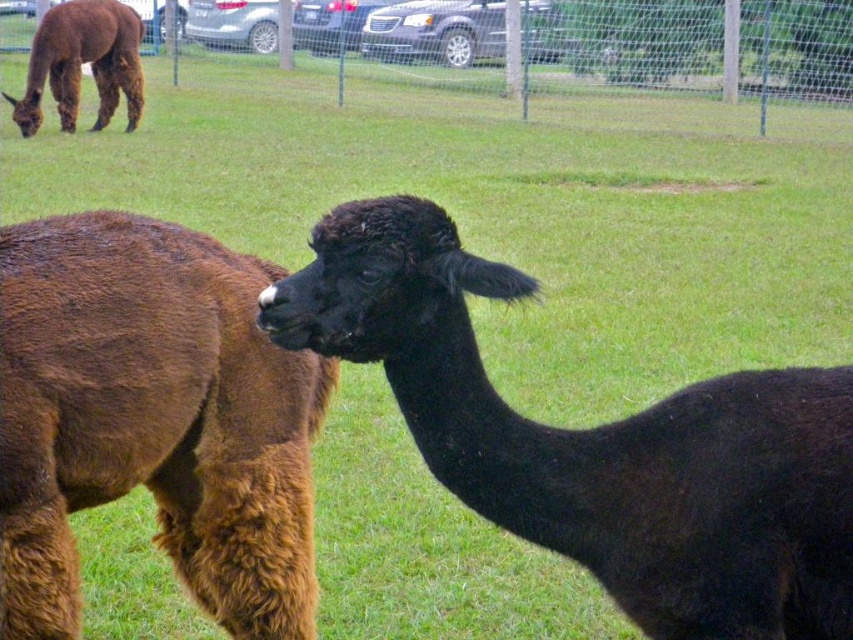
Question: Is brown fuzzy camel at left to the left of fence at upper center from the viewer's perspective?

Choices:
 (A) no
 (B) yes

Answer: (A)

Question: Based on their relative distances, which object is farther from the brown woolly alpaca at upper left?

Choices:
 (A) fence at upper center
 (B) black fuzzy alpaca at center

Answer: (B)

Question: Is black fuzzy alpaca at center in front of fence at upper center?

Choices:
 (A) no
 (B) yes

Answer: (B)

Question: Based on their relative distances, which object is nearer to the brown woolly alpaca at upper left?

Choices:
 (A) brown fuzzy camel at left
 (B) fence at upper center

Answer: (B)

Question: Which of the following is the farthest from the observer?

Choices:
 (A) brown fuzzy camel at left
 (B) black fuzzy alpaca at center
 (C) fence at upper center

Answer: (C)

Question: Is fence at upper center positioned at the back of brown woolly alpaca at upper left?

Choices:
 (A) yes
 (B) no

Answer: (A)